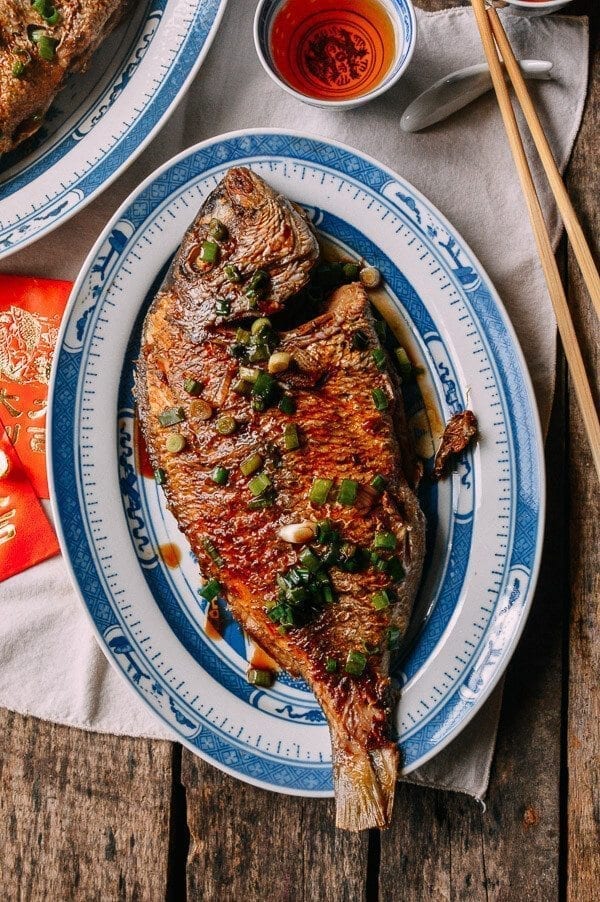
In order to click on blue and white bowl in this screenshot , I will do `click(416, 30)`.